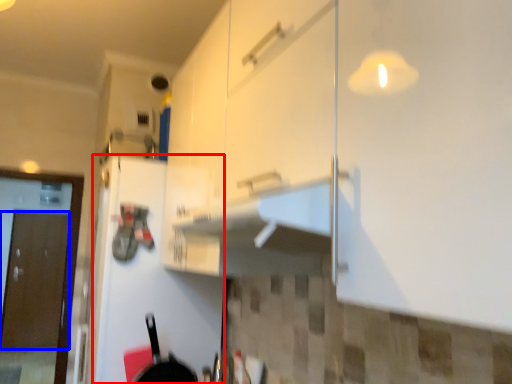
Question: Which point is further to the camera, door (highlighted by a red box) or door (highlighted by a blue box)?

Choices:
 (A) door
 (B) door

Answer: (B)